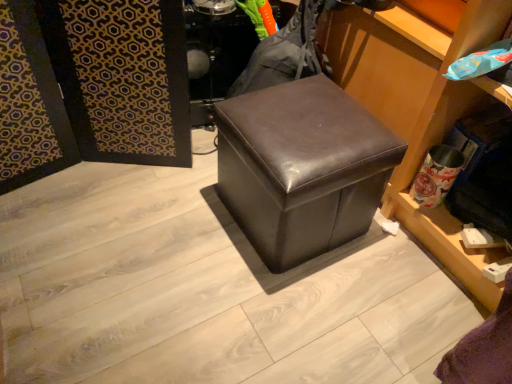
The image size is (512, 384). I want to click on white matte towel at lower right, so click(x=422, y=325).

The height and width of the screenshot is (384, 512). Describe the element at coordinates (422, 325) in the screenshot. I see `white matte towel at lower right` at that location.

What do you see at coordinates (302, 168) in the screenshot? The height and width of the screenshot is (384, 512). I see `matte brown ottoman at center` at bounding box center [302, 168].

Where is `matte brown ottoman at center`? The width and height of the screenshot is (512, 384). matte brown ottoman at center is located at coordinates (302, 168).

What is the approximate width of matte brown ottoman at center?

17.53 inches.

You are a GUI agent. You are given a task and a screenshot of the screen. Output one action in this format:
    pyautogui.click(x=<x>, y=<y>)
    Task: Click on the white matte towel at lower right
    
    Given the screenshot: What is the action you would take?
    pyautogui.click(x=422, y=325)

Is matte brown ottoman at center to the right of white matte towel at lower right from the viewer's perspective?

A: No.

Is matte brown ottoman at center positioned behind white matte towel at lower right?

Yes, matte brown ottoman at center is further from the camera.

Does point (335, 231) come farther from viewer compared to point (416, 317)?

Yes, point (335, 231) is farther from viewer.

From the image's perspective, is matte brown ottoman at center under white matte towel at lower right?

No, from the image's perspective, matte brown ottoman at center is not below white matte towel at lower right.

From a real-world perspective, relative to white matte towel at lower right, is matte brown ottoman at center vertically above or below?

From a real-world perspective, matte brown ottoman at center is physically below white matte towel at lower right.

Which of these two, matte brown ottoman at center or white matte towel at lower right, is thinner?

white matte towel at lower right.

Considering the sizes of objects matte brown ottoman at center and white matte towel at lower right in the image provided, who is taller, matte brown ottoman at center or white matte towel at lower right?

white matte towel at lower right is taller.

Does matte brown ottoman at center have a larger size compared to white matte towel at lower right?

Correct, matte brown ottoman at center is larger in size than white matte towel at lower right.

Is matte brown ottoman at center located outside white matte towel at lower right?

Absolutely, matte brown ottoman at center is external to white matte towel at lower right.

Is matte brown ottoman at center far from white matte towel at lower right?

No, matte brown ottoman at center is not far from white matte towel at lower right.

Is matte brown ottoman at center oriented away from white matte towel at lower right?

No, matte brown ottoman at center is not facing the opposite direction of white matte towel at lower right.

I want to click on furniture below the white matte towel at lower right (from a real-world perspective), so click(302, 168).

Is white matte towel at lower right to the right of matte brown ottoman at center from the viewer's perspective?

Indeed, white matte towel at lower right is positioned on the right side of matte brown ottoman at center.

Based on the photo, is white matte towel at lower right in front of or behind matte brown ottoman at center in the image?

white matte towel at lower right is in front of matte brown ottoman at center.

Does point (466, 326) come closer to viewer compared to point (245, 205)?

Yes, point (466, 326) is closer to viewer.

From the image's perspective, is white matte towel at lower right beneath matte brown ottoman at center?

Correct, white matte towel at lower right appears lower than matte brown ottoman at center in the image.

From a real-world perspective, is white matte towel at lower right positioned above or below matte brown ottoman at center?

In terms of real-world spatial position, white matte towel at lower right is above matte brown ottoman at center.

Is white matte towel at lower right thinner than matte brown ottoman at center?

Correct, the width of white matte towel at lower right is less than that of matte brown ottoman at center.

Does white matte towel at lower right have a lesser height compared to matte brown ottoman at center?

No, white matte towel at lower right is not shorter than matte brown ottoman at center.

Who is bigger, white matte towel at lower right or matte brown ottoman at center?

Bigger between the two is matte brown ottoman at center.

Would you say white matte towel at lower right is inside or outside matte brown ottoman at center?

white matte towel at lower right is spatially situated outside matte brown ottoman at center.

Is white matte towel at lower right next to matte brown ottoman at center?

white matte towel at lower right and matte brown ottoman at center are clearly separated.

Is white matte towel at lower right facing towards matte brown ottoman at center?

No.

The width and height of the screenshot is (512, 384). In order to click on furniture behind the white matte towel at lower right in this screenshot , I will do `click(302, 168)`.

This screenshot has width=512, height=384. Find the location of `furniture on the left of white matte towel at lower right`. furniture on the left of white matte towel at lower right is located at coordinates (302, 168).

Where is `square in front of the matte brown ottoman at center`? Image resolution: width=512 pixels, height=384 pixels. square in front of the matte brown ottoman at center is located at coordinates (422, 325).